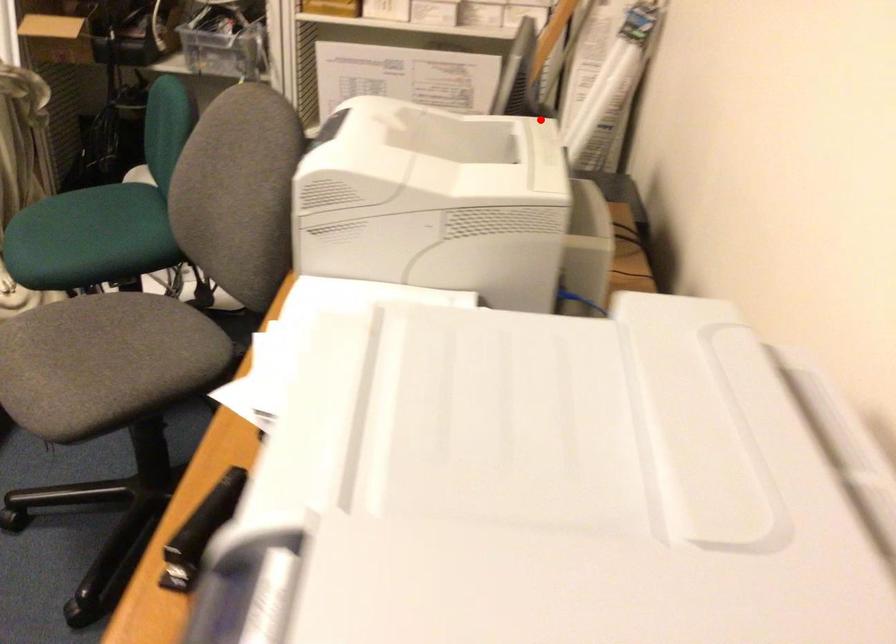
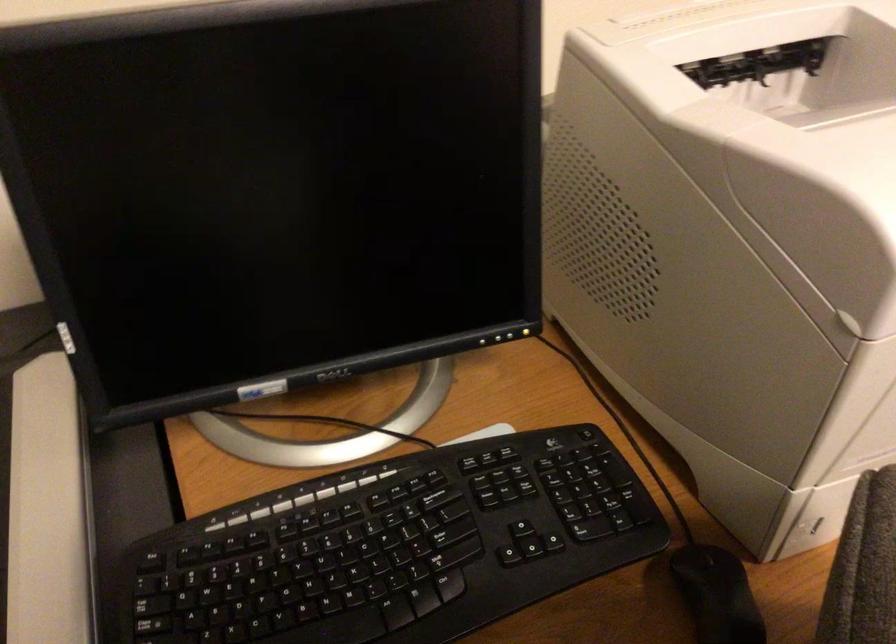
Where in the second image is the point corresponding to the highlighted location from the first image?

(616, 21)